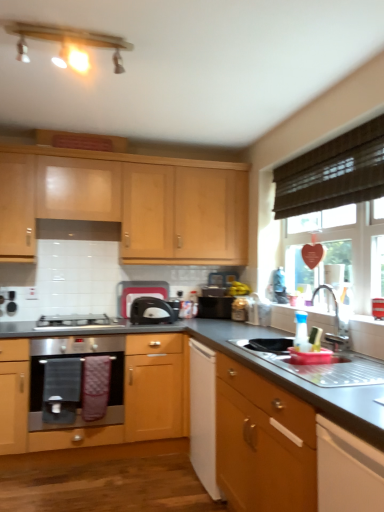
Image resolution: width=384 pixels, height=512 pixels. I want to click on vacant area that is in front of black plastic toaster at center, placed as the 1th appliance when sorted from right to left, so click(x=218, y=320).